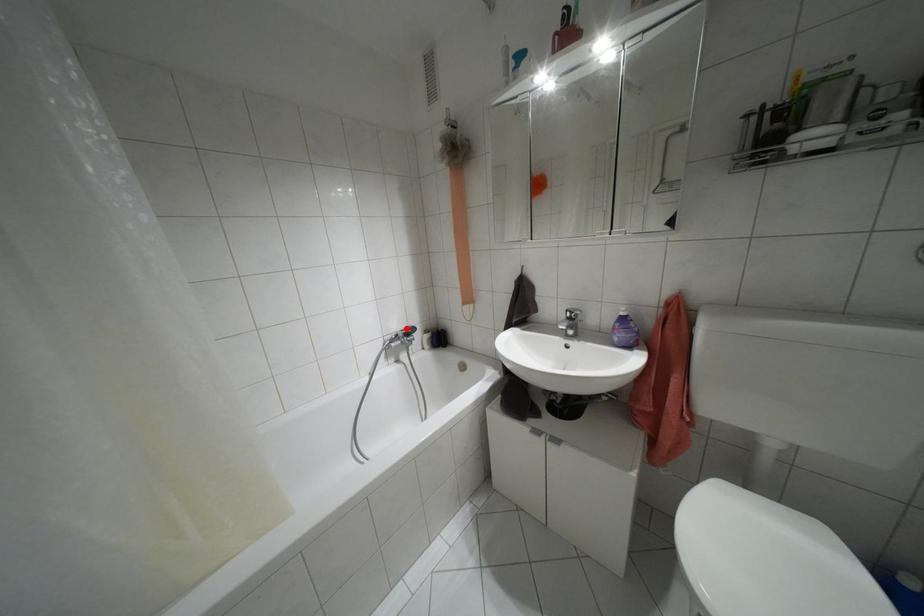
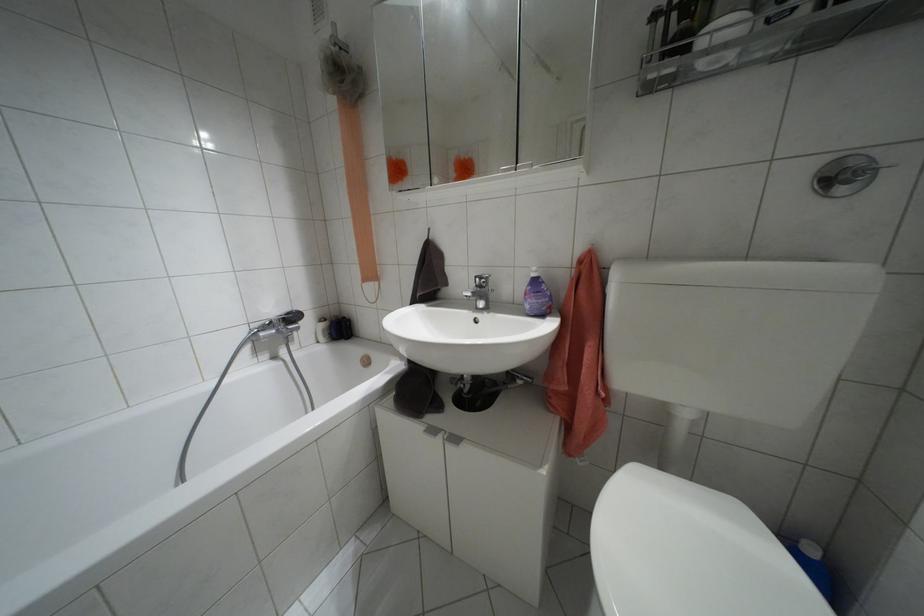
Question: I am providing you with two images of the same scene from different viewpoints. A red point is marked on the first image. Is the red point's position out of view in image 2?

Choices:
 (A) Yes
 (B) No

Answer: (B)